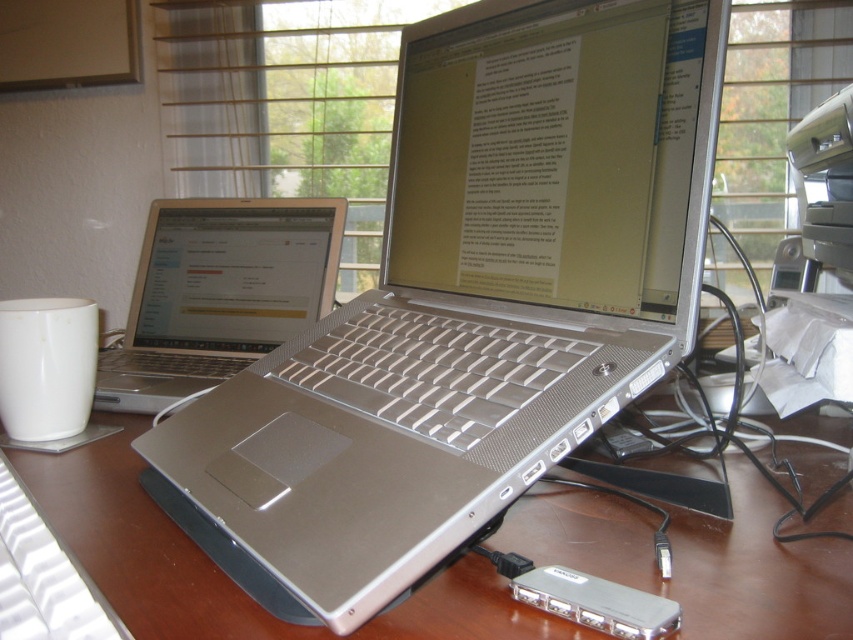
Question: Which of the following is the closest to the observer?

Choices:
 (A) white matte mug at left
 (B) white plastic keyboard at lower left
 (C) brown wooden table at center
 (D) silver metallic laptop at left

Answer: (B)

Question: Does brown wooden table at center have a larger size compared to white plastic keyboard at lower left?

Choices:
 (A) yes
 (B) no

Answer: (A)

Question: Can you confirm if brown wooden table at center is smaller than white matte mug at left?

Choices:
 (A) yes
 (B) no

Answer: (B)

Question: Among these objects, which one is nearest to the camera?

Choices:
 (A) white plastic keyboard at lower left
 (B) white matte mug at left

Answer: (A)

Question: Is silver metallic laptop at center in front of brown wooden table at center?

Choices:
 (A) yes
 (B) no

Answer: (A)

Question: Which object is the closest to the brown wooden table at center?

Choices:
 (A) white matte mug at left
 (B) white plastic keyboard at lower left

Answer: (B)